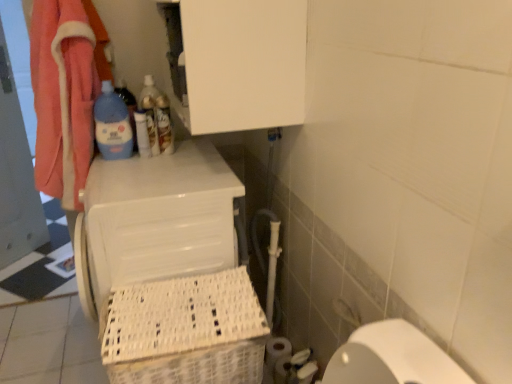
Question: From their relative heights in the image, would you say translucent plastic bottle at upper center, which is the second bottle in left-to-right order, is taller or shorter than white matte toilet paper at lower right, placed as the second toilet paper when sorted from front to back?

Choices:
 (A) short
 (B) tall

Answer: (A)

Question: Is translucent plastic bottle at upper center, which is the second bottle in left-to-right order, in front of or behind white matte toilet paper at lower right, which is the 2th toilet paper in back-to-front order, in the image?

Choices:
 (A) front
 (B) behind

Answer: (B)

Question: Which is nearer to the white plastic laundry basket at lower left?

Choices:
 (A) blue glossy bottle at upper left, marked as the 3th bottle in a right-to-left arrangement
 (B) white matte toilet paper at lower right, which is the 1th toilet paper in front-to-back order
 (C) white matte toilet paper at lower right, the first toilet paper viewed from the back
 (D) white plastic basket at lower left
 (E) white matte toilet paper at lower right, placed as the second toilet paper when sorted from front to back

Answer: (D)

Question: Based on their relative distances, which object is farther from the white plastic laundry basket at lower left?

Choices:
 (A) white plastic basket at lower left
 (B) white matte toilet paper at lower right, which is the 1th toilet paper in front-to-back order
 (C) white matte toilet paper at lower right, the third toilet paper in the front-to-back sequence
 (D) translucent plastic bottle at upper center, placed as the 2th bottle when sorted from right to left
 (E) translucent plastic bottle at upper center, the 3th bottle in the left-to-right sequence

Answer: (C)